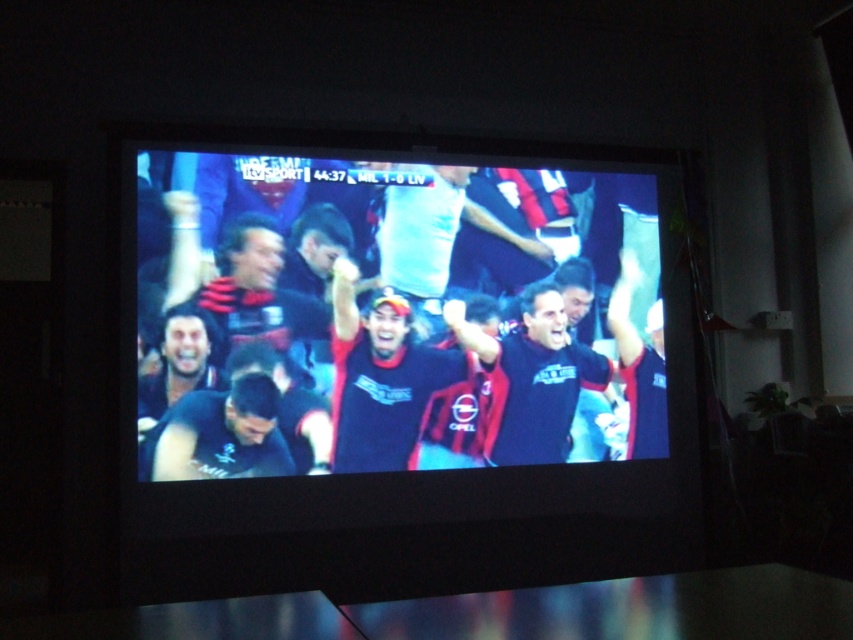
Question: Can you confirm if black matte shirt at center is positioned to the left of matte black shirt at lower left?

Choices:
 (A) no
 (B) yes

Answer: (A)

Question: Which point is closer to the camera?

Choices:
 (A) (149, 332)
 (B) (587, 387)
 (C) (428, 369)
 (D) (277, 433)

Answer: (A)

Question: Estimate the real-world distances between objects in this image. Which object is farther from the matte black shirt at lower left?

Choices:
 (A) dark blue jersey at center
 (B) black matte shirt at center

Answer: (B)

Question: Does black matte television at center have a smaller size compared to dark blue jersey at center?

Choices:
 (A) no
 (B) yes

Answer: (A)

Question: Is black matte television at center above dark blue jersey at center?

Choices:
 (A) yes
 (B) no

Answer: (B)

Question: Which of the following is the farthest from the observer?

Choices:
 (A) black matte television at center
 (B) black matte shirt at center
 (C) dark blue jersey at center

Answer: (B)